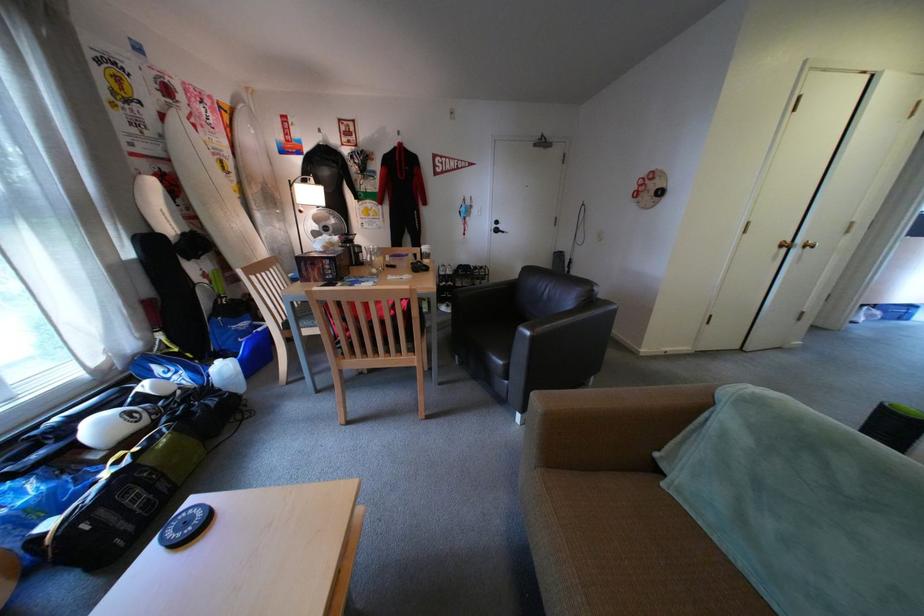
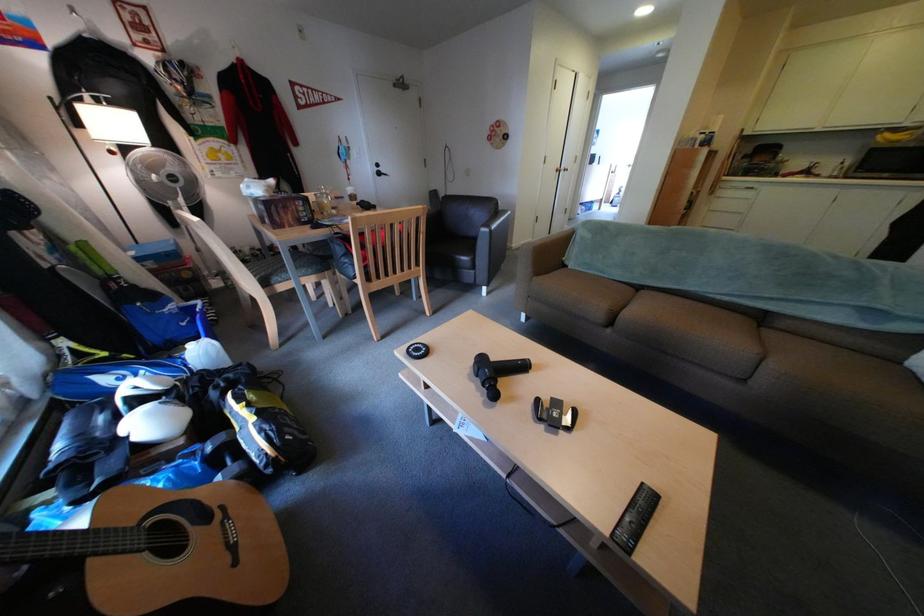
Where in the second image is the point corresponding to (520,383) from the first image?

(487, 273)